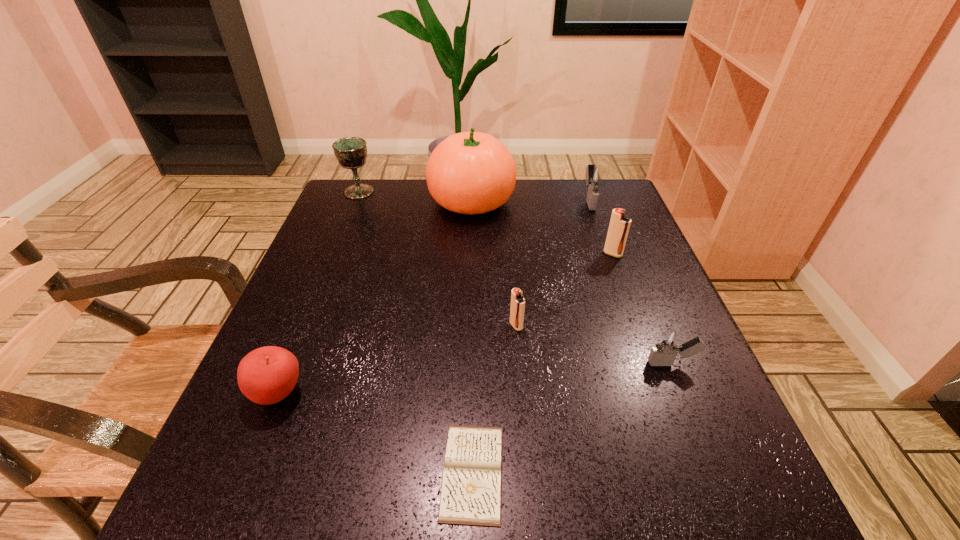
Image resolution: width=960 pixels, height=540 pixels. Find the location of `unoccupied area between the right red igniter and the leftmost igniter`. unoccupied area between the right red igniter and the leftmost igniter is located at coordinates (564, 290).

This screenshot has width=960, height=540. Find the location of `free space between the diary and the tallest object`. free space between the diary and the tallest object is located at coordinates (472, 336).

The height and width of the screenshot is (540, 960). I want to click on free area in between the red apple and the shortest object, so click(375, 433).

Where is `free space between the shortest object and the pumpkin`? The image size is (960, 540). free space between the shortest object and the pumpkin is located at coordinates (472, 336).

Locate an element on the screen. This screenshot has width=960, height=540. vacant region between the red apple and the bigger red igniter is located at coordinates (445, 324).

You are a GUI agent. You are given a task and a screenshot of the screen. Output one action in this format:
    pyautogui.click(x=<x>, y=<y>)
    Task: Click on the third closest object to the smaller gray igniter
    
    Given the screenshot: What is the action you would take?
    pyautogui.click(x=471, y=491)

Choose which object is the third nearest neighbor to the nearer gray igniter. Please provide its 2D coordinates. Your answer should be formatted as a tuple, i.e. [(x, y)], where the tuple contains the x and y coordinates of a point satisfying the conditions above.

[(471, 491)]

Locate an element on the screen. This screenshot has width=960, height=540. the second closest igniter to the fourth farthest object is located at coordinates (667, 346).

Identify the location of the third closest igniter to the fifth nearest object. The height and width of the screenshot is (540, 960). (517, 309).

This screenshot has height=540, width=960. I want to click on free space that satisfies the following two spatial constraints: 1. on the back side of the leftmost igniter; 2. on the right side of the bigger gray igniter, so click(506, 200).